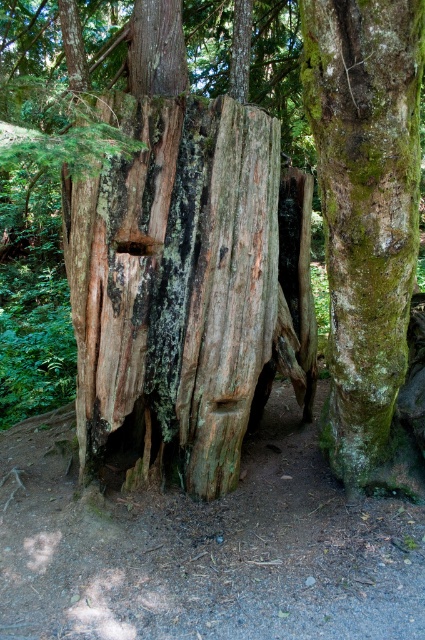
You are a hiker who has stumbled upon this forest scene. You notice a point marked at coordinates [136,246]. Based on the scene description, what is the most likely material located at this point?

The point at coordinates 0.320 corresponds to smooth brown wood at center, which is likely part of the large weathered tree stump described in the scene.

You are a small animal trying to travel from the green mossy bark at center to the smooth wood hole at center. Can you fit through the space between them? Your body is 12 inches wide.

The distance between the green mossy bark at center and smooth wood hole at center is 35.93 inches, so yes, the small animal can fit through the space between them since the space is wider than the animal.

You are an artist sketching the forest scene. You want to highlight the contrast between the green mossy bark at center and the smooth brown wood at center. Which object should you emphasize as larger to show this contrast?

The green mossy bark at center is larger than the smooth brown wood at center, so you should emphasize the green mossy bark at center as larger to show the contrast between them.